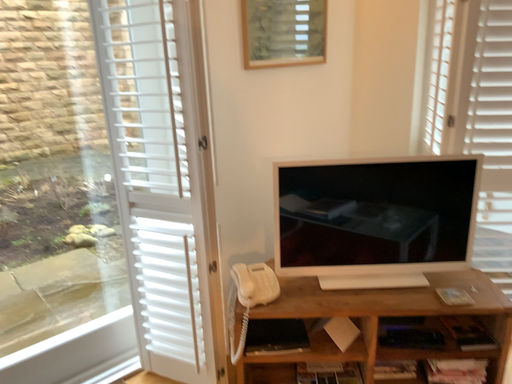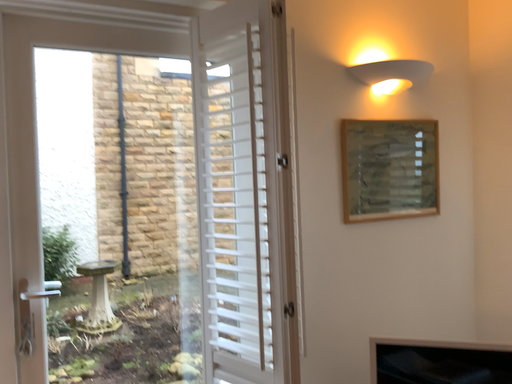
Question: How did the camera likely rotate when shooting the video?

Choices:
 (A) rotated downward
 (B) rotated upward

Answer: (B)